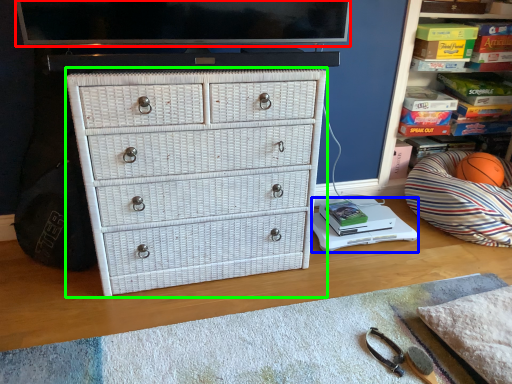
Question: Based on their relative distances, which object is farther from television (highlighted by a red box)? Choose from changing table (highlighted by a blue box) and chest of drawers (highlighted by a green box).

Choices:
 (A) changing table
 (B) chest of drawers

Answer: (A)